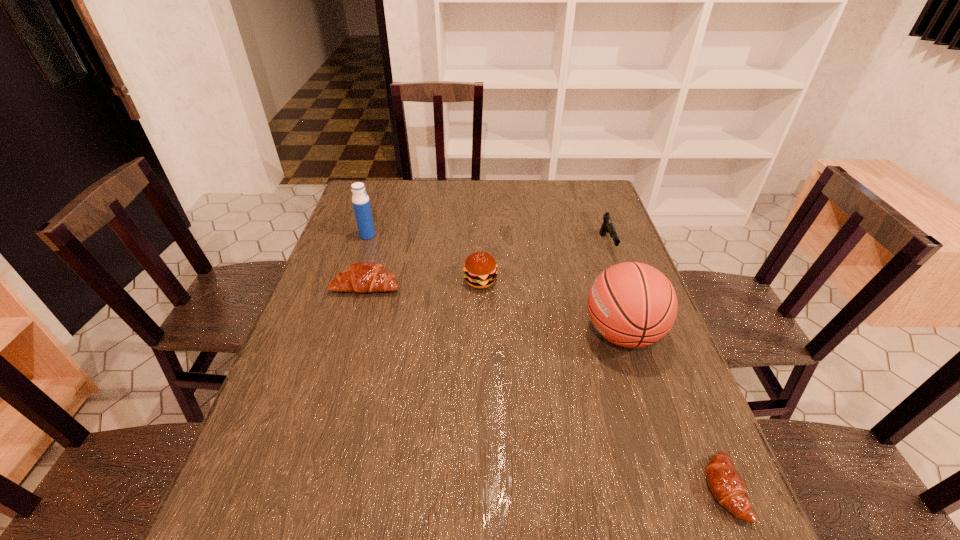
The height and width of the screenshot is (540, 960). What are the coordinates of `free spot that satisfies the following two spatial constraints: 1. on the logo side of the shortest object; 2. on the right side of the fifth farthest object` in the screenshot? It's located at (673, 489).

The image size is (960, 540). In order to click on vacant space that satisfies the following two spatial constraints: 1. at the aiming end of the gun; 2. on the right side of the shortest object in this screenshot , I will do `click(693, 489)`.

The image size is (960, 540). Identify the location of vacant position in the image that satisfies the following two spatial constraints: 1. on the logo side of the basketball; 2. on the left side of the nearest object. pyautogui.click(x=673, y=489).

You are a GUI agent. You are given a task and a screenshot of the screen. Output one action in this format:
    pyautogui.click(x=<x>, y=<y>)
    Task: Click on the blank area in the image that satisfies the following two spatial constraints: 1. at the aiming end of the gun; 2. on the right side of the right crescent roll
    This screenshot has height=540, width=960.
    Given the screenshot: What is the action you would take?
    pyautogui.click(x=693, y=489)

The image size is (960, 540). In order to click on blank space that satisfies the following two spatial constraints: 1. on the logo side of the shorter crescent roll; 2. on the left side of the basketball in this screenshot , I will do `click(673, 489)`.